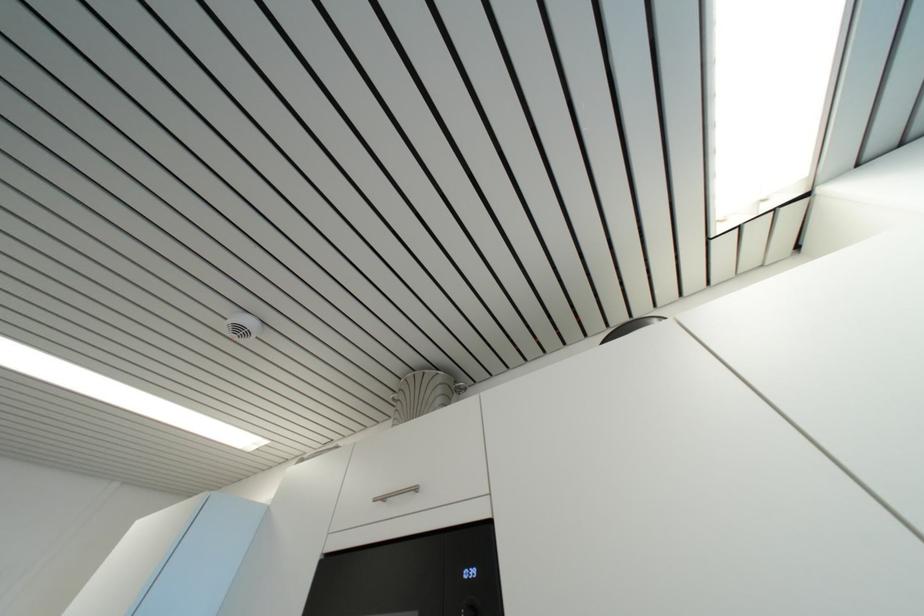
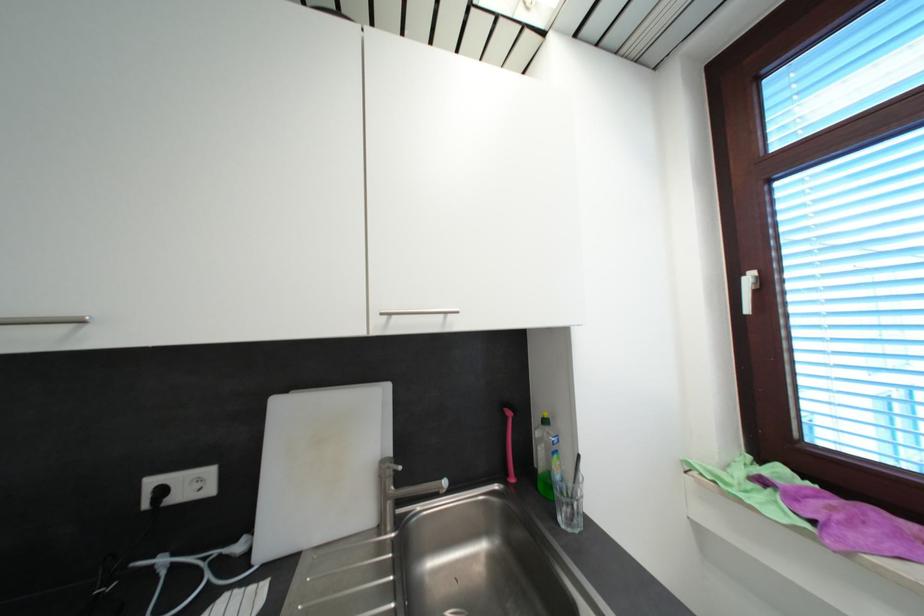
First-person continuous shooting, in which direction is the camera rotating?

The camera rotated toward right-down.